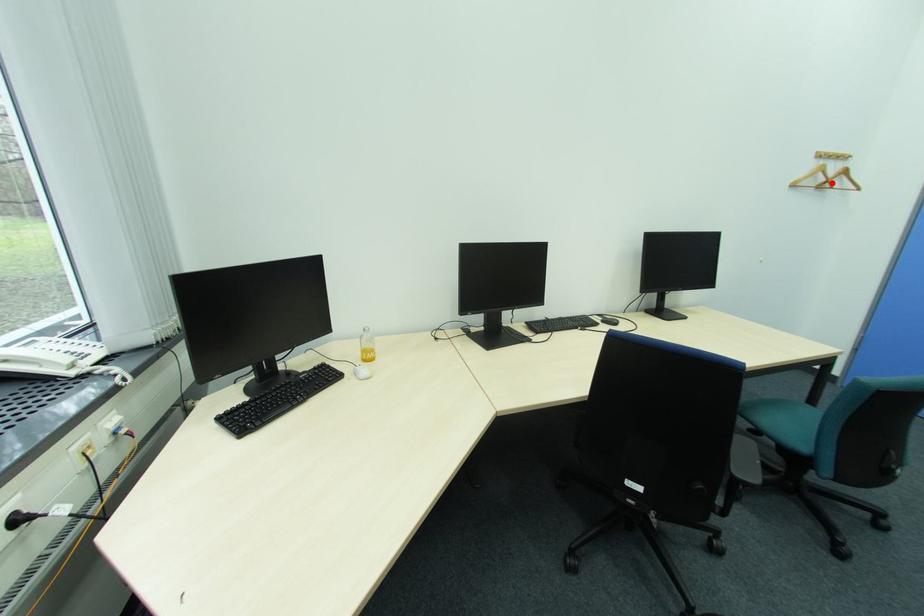
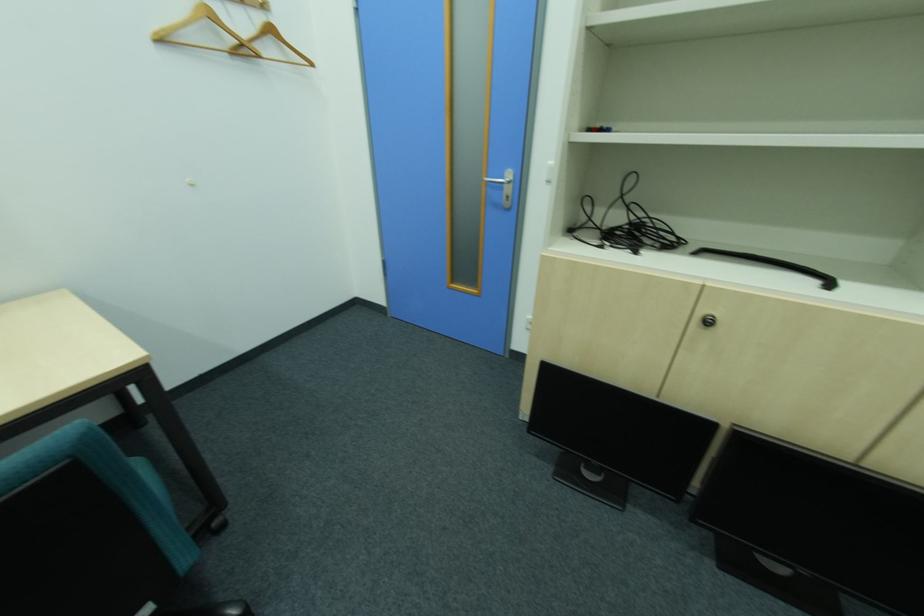
The point at the highlighted location is marked in the first image. Where is the corresponding point in the second image?

(249, 45)